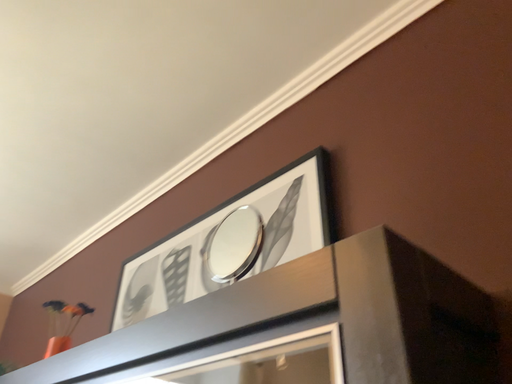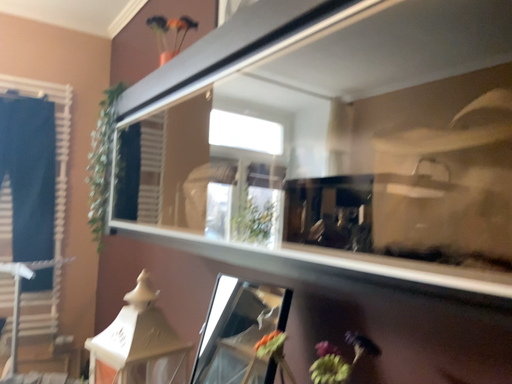
Question: Which way did the camera rotate in the video?

Choices:
 (A) rotated right
 (B) rotated left

Answer: (B)